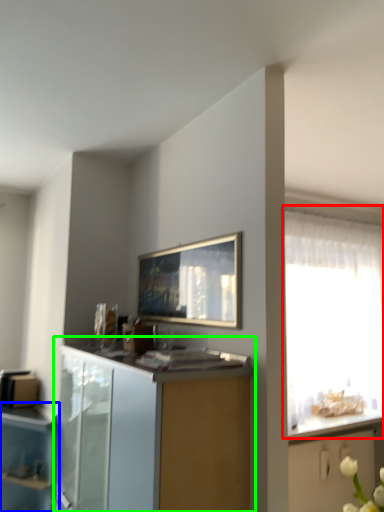
Question: Estimate the real-world distances between objects in this image. Which object is closer to window (highlighted by a red box), cupboard (highlighted by a blue box) or cabinetry (highlighted by a green box)?

Choices:
 (A) cupboard
 (B) cabinetry

Answer: (B)